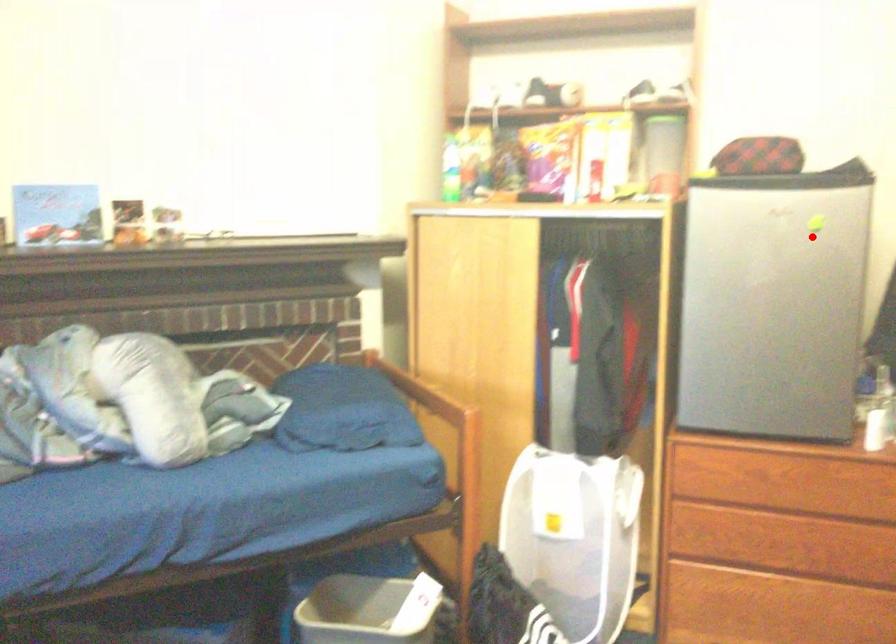
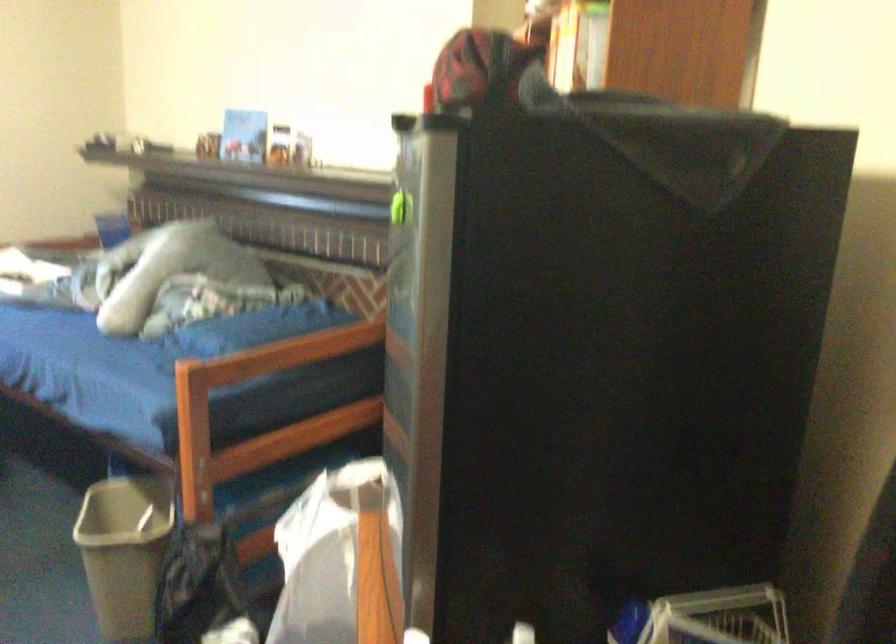
Locate, in the second image, the point that corresponds to the highlighted location in the first image.

(400, 207)